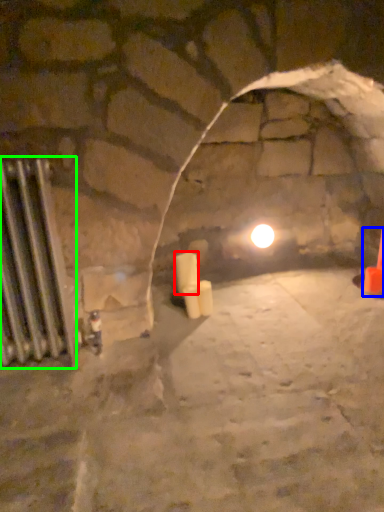
Question: Which object is the farthest from candle (highlighted by a red box)? Choose among these: traffic cone (highlighted by a blue box) or radiator (highlighted by a green box).

Choices:
 (A) traffic cone
 (B) radiator

Answer: (A)